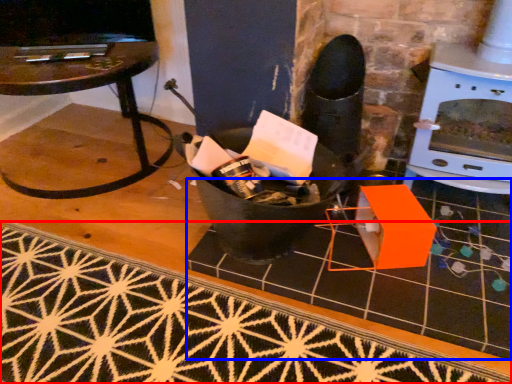
Question: Among these objects, which one is farthest to the camera, doormat (highlighted by a red box) or tile (highlighted by a blue box)?

Choices:
 (A) doormat
 (B) tile

Answer: (B)